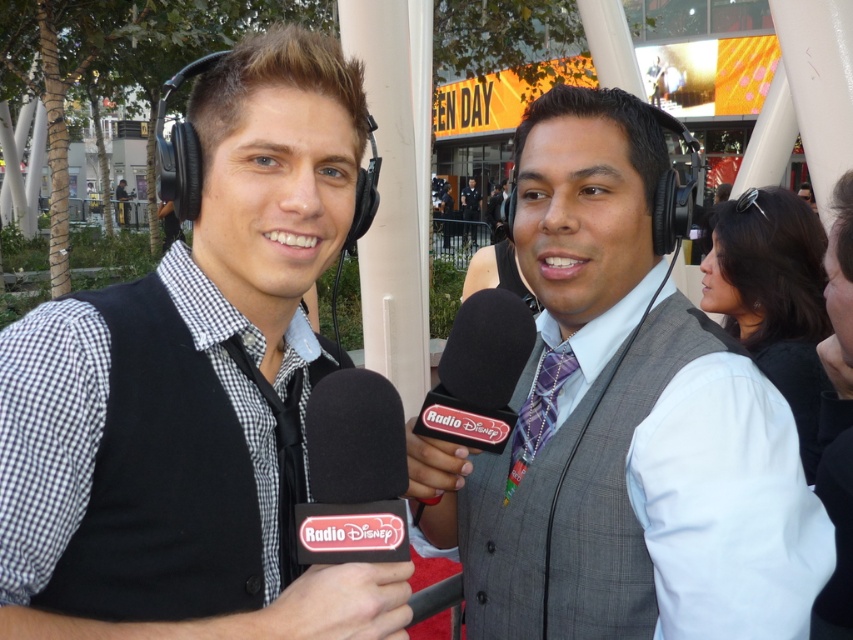
Who is more distant from viewer, (500, 456) or (563, 362)?

Point (500, 456)

Which is more to the left, matte gray vest at center or purple plaid tie at center?

From the viewer's perspective, purple plaid tie at center appears more on the left side.

In order to click on matte gray vest at center in this screenshot , I will do `click(709, 493)`.

Where is `matte gray vest at center`? The width and height of the screenshot is (853, 640). matte gray vest at center is located at coordinates (709, 493).

Is point (20, 458) in front of point (450, 433)?

Yes, it is in front of point (450, 433).

Is matte black vest at left bigger than black plastic microphone at center?

Yes.

Where is `matte black vest at left`? This screenshot has height=640, width=853. matte black vest at left is located at coordinates (207, 344).

Is black foam microphone at center thinner than matte black vest at center?

Yes.

The image size is (853, 640). What do you see at coordinates (352, 472) in the screenshot?
I see `black foam microphone at center` at bounding box center [352, 472].

Locate an element on the screen. The image size is (853, 640). black foam microphone at center is located at coordinates (352, 472).